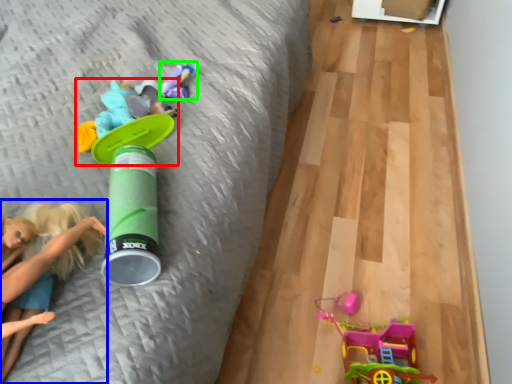
Question: Which is nearer to the toy (highlighted by a red box)? person (highlighted by a blue box) or toy (highlighted by a green box).

Choices:
 (A) person
 (B) toy

Answer: (B)